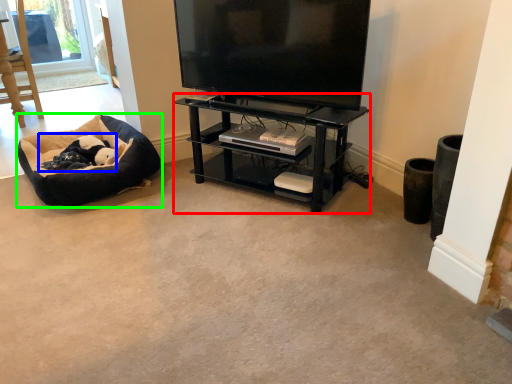
Question: Based on their relative distances, which object is farther from shelf (highlighted by a red box)? Choose from animal (highlighted by a blue box) and dog bed (highlighted by a green box).

Choices:
 (A) animal
 (B) dog bed

Answer: (A)